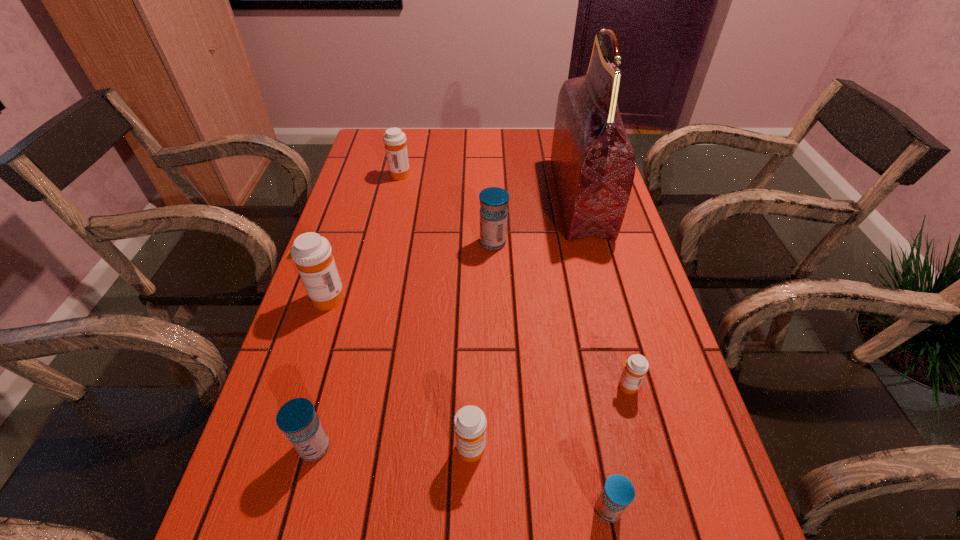
Locate an element on the screen. Image resolution: width=960 pixels, height=540 pixels. the tallest object is located at coordinates (593, 161).

I want to click on the fourth farthest object, so click(312, 254).

Image resolution: width=960 pixels, height=540 pixels. In order to click on the leftmost orange medicine in this screenshot , I will do `click(312, 254)`.

You are a GUI agent. You are given a task and a screenshot of the screen. Output one action in this format:
    pyautogui.click(x=<x>, y=<y>)
    Task: Click on the farthest medicine
    This screenshot has width=960, height=540.
    Given the screenshot: What is the action you would take?
    pyautogui.click(x=395, y=141)

Find the location of a particular element. The height and width of the screenshot is (540, 960). the second biggest orange medicine is located at coordinates (395, 141).

The width and height of the screenshot is (960, 540). Identify the location of the second blue medicine from left to right. (493, 212).

Image resolution: width=960 pixels, height=540 pixels. Identify the location of the farthest blue medicine. point(493,212).

Find the location of a particular element. the third biggest orange medicine is located at coordinates (469, 422).

Find the location of `the nearest orange medicine`. the nearest orange medicine is located at coordinates (469, 422).

You are a GUI agent. You are given a task and a screenshot of the screen. Output one action in this format:
    pyautogui.click(x=<x>, y=<y>)
    Task: Click on the leftmost blue medicine
    
    Given the screenshot: What is the action you would take?
    pyautogui.click(x=297, y=418)